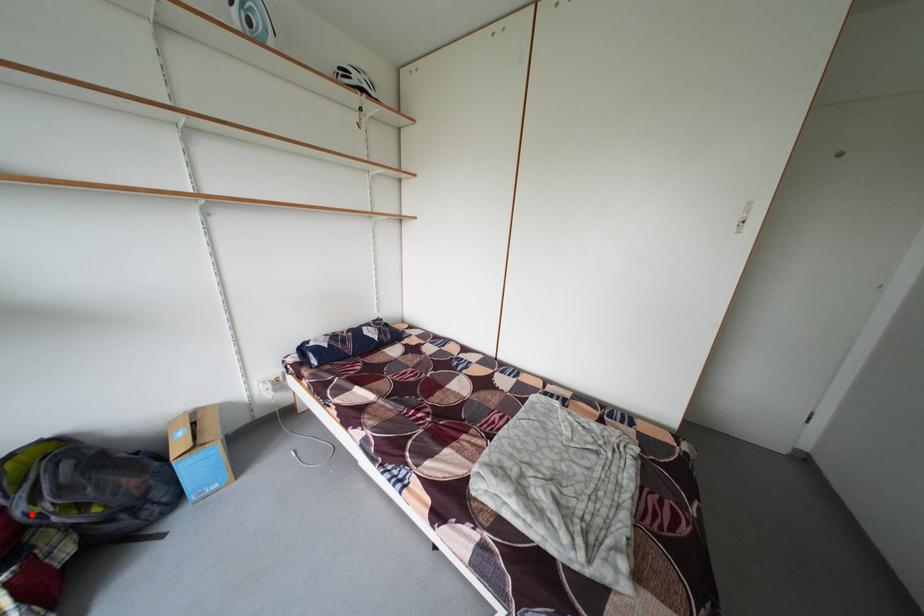
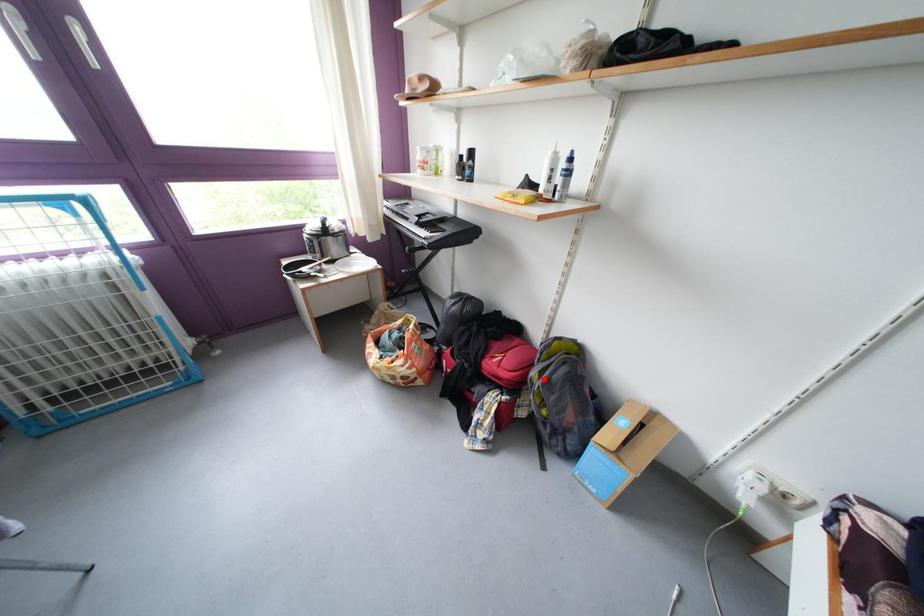
I am providing you with two images of the same scene from different viewpoints. A red point is marked on the first image and another point is marked on the second image. Is the red point in image1 aligned with the point shown in image2?

Yes